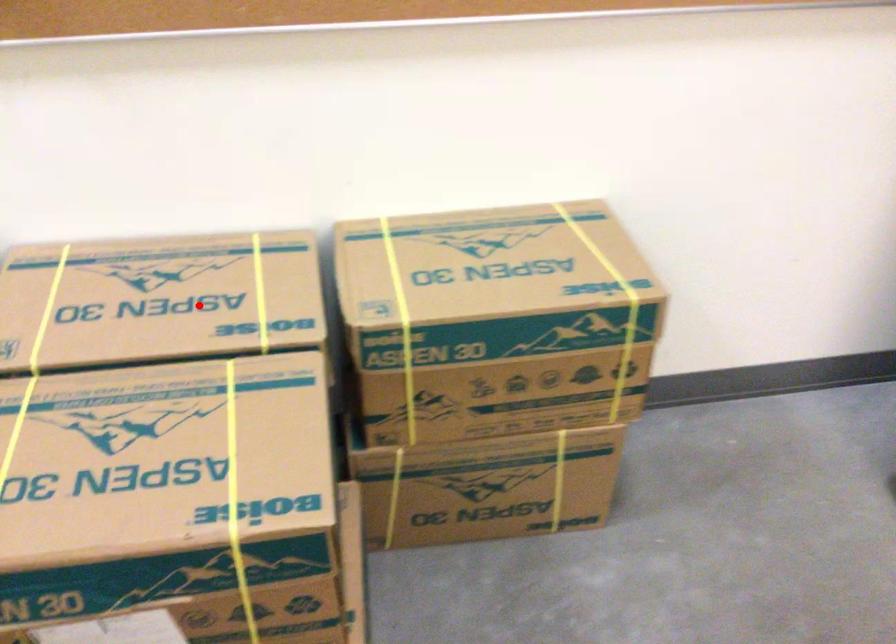
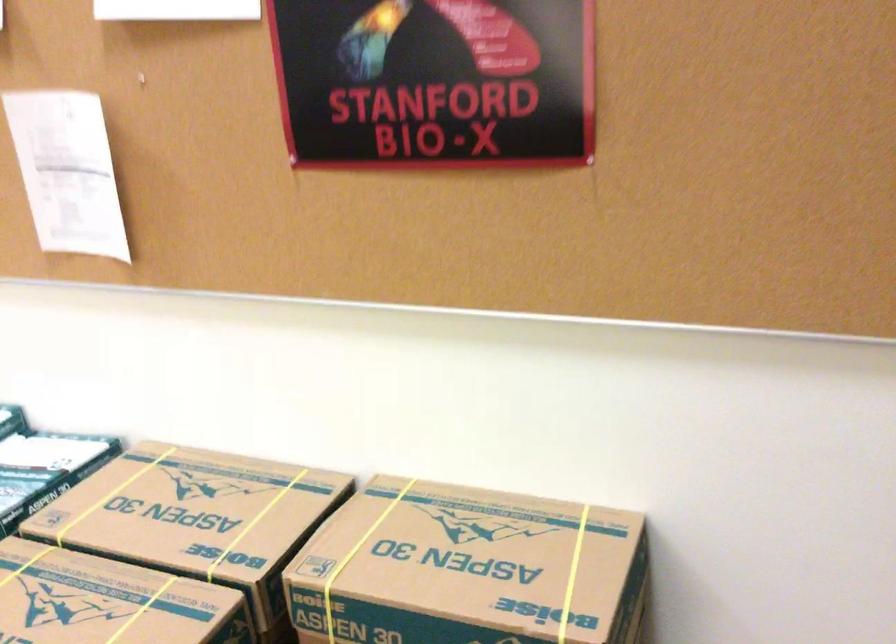
Where in the second image is the point corresponding to the highlighted location from the first image?

(197, 518)